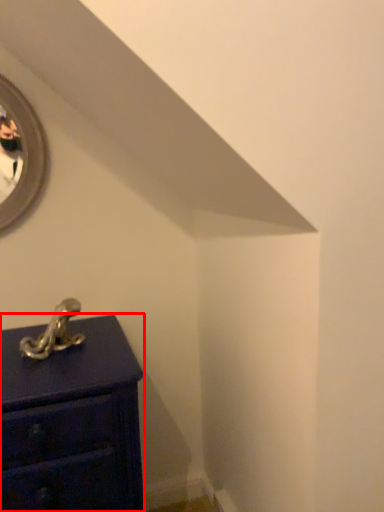
Question: Where is chest of drawers (annotated by the red box) located in relation to antique in the image?

Choices:
 (A) right
 (B) left

Answer: (A)